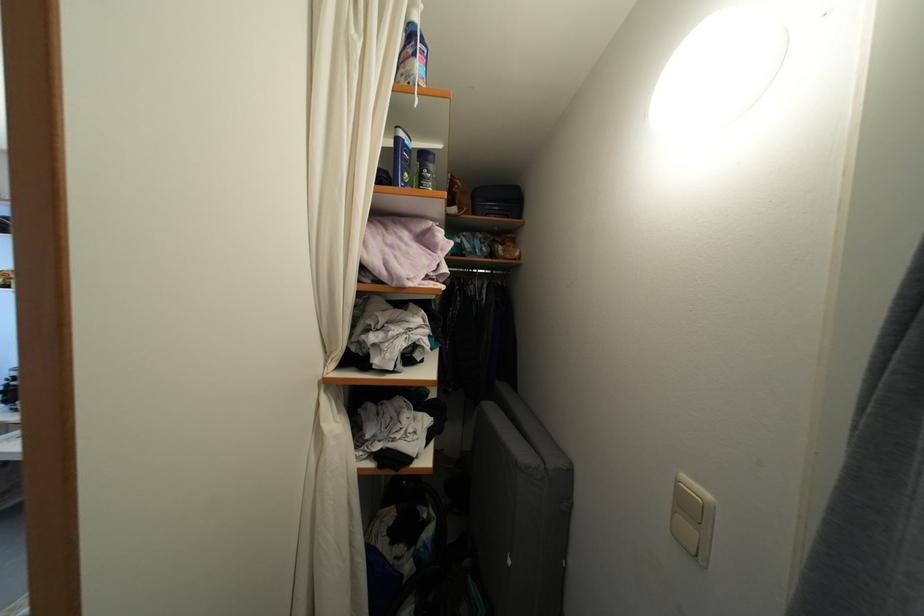
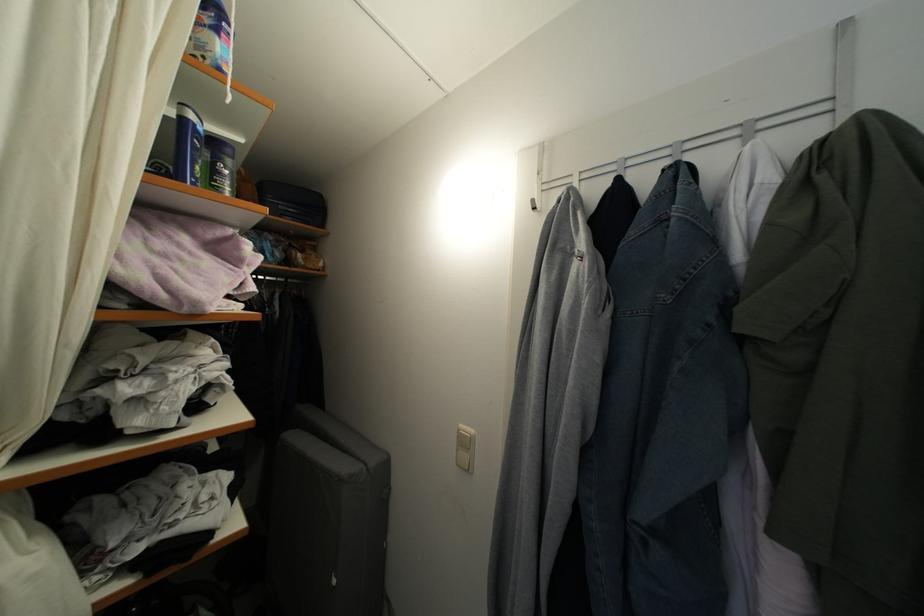
Find the pixel in the second image that matches (492,214) in the first image.

(286, 214)